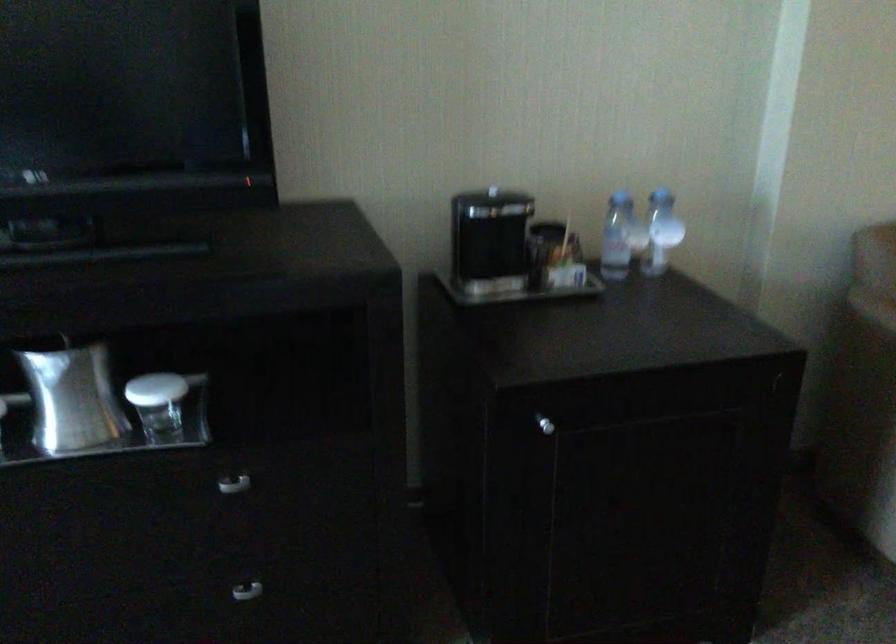
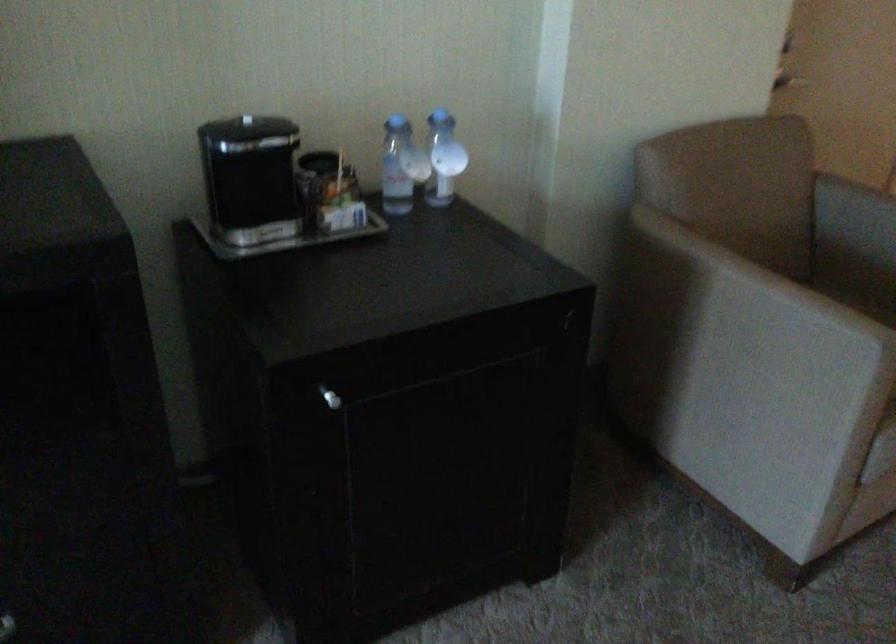
Find the pixel in the second image that matches (x=538, y=422) in the first image.

(330, 398)